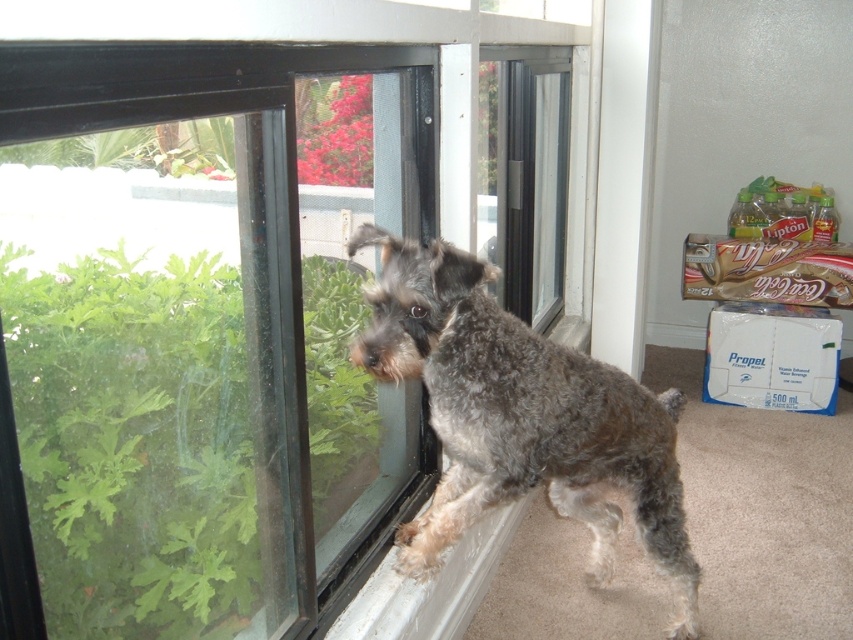
You are a delivery robot trying to find the entrance to the house. You see the point marked at coordinates (245, 285). What is the object at that point that you should look for to locate the entrance?

The point at coordinates (245, 285) marks the clear glass window at center. The entrance is likely near the window, so look for a door adjacent to the clear glass window at center.

You are a delivery robot trying to locate the clear glass window at center. Based on the coordinates provided, where should you look to find it?

The clear glass window at center is located at coordinates point 0.447 on the x axis and 0.288 on the y axis.

You are standing in the room where the small dog is. You want to place a small sticker on the point that is closer to you. Which point should you choose between point (364, 573) and point (402, 268)?

Point (402, 268) is closer to you than point (364, 573), so you should choose point (402, 268) to place the sticker.